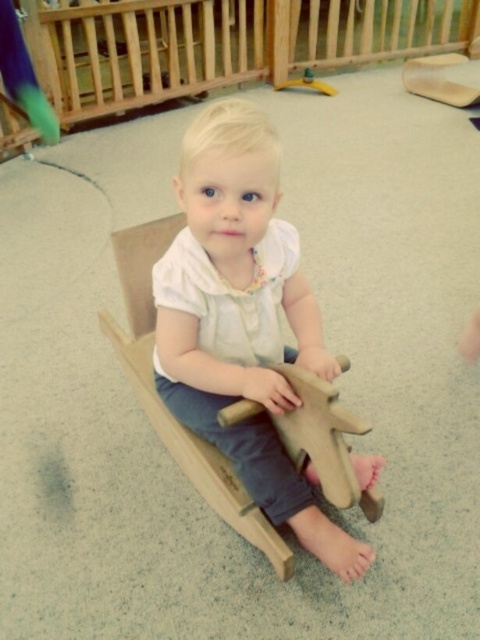
You are a parent trying to choose between two wooden toys for your child. You see the wooden rocking horse at center and the wooden horse at center in the image. Which one is bigger?

The wooden rocking horse at center is larger in size than the wooden horse at center, so the wooden rocking horse at center is bigger.

You are a photographer trying to capture the best angle of the child on the rocking horse. You notice two points marked in the scene. Which point is closer to the camera, point (267, 266) or point (278, 88)?

Point (267, 266) is in front of point (278, 88), so the photographer should focus on point (267, 266) as it is closer to the camera.

You are a photographer setting up a shot of the wooden rocking horse at center. You need to place a small light exactly at the point where the wooden rocking horse is located. The coordinates given are point (x=242, y=317). Where should you place the light?

The point (x=242, y=317) indicates the wooden rocking horse at center, so you should place the light directly at the center of the wooden rocking horse at center to match the coordinates provided.